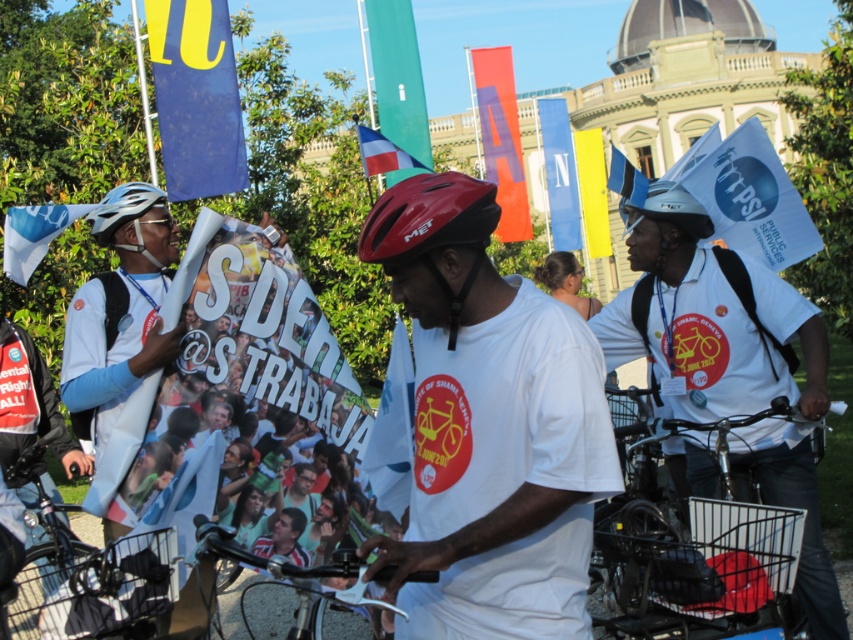
Which of these two, blue fabric flag at left or shiny silver helmet at left, stands taller?

blue fabric flag at left

Looking at this image, is blue fabric flag at left bigger than shiny silver helmet at left?

Indeed, blue fabric flag at left has a larger size compared to shiny silver helmet at left.

Who is more forward, [10,240] or [113,216]?

Point [10,240]

I want to click on blue fabric flag at left, so click(x=33, y=234).

Is white matte t-shirt at center closer to camera compared to blue fabric flag at left?

Yes, it is.

Image resolution: width=853 pixels, height=640 pixels. What are the coordinates of `white matte t-shirt at center` in the screenshot? It's located at (489, 426).

Where is `white matte t-shirt at center`? white matte t-shirt at center is located at coordinates (489, 426).

At what (x,y) coordinates should I click in order to perform the action: click on white paper poster at center. Please return your answer as a coordinate pair (x, y). This screenshot has height=640, width=853. Looking at the image, I should click on (242, 404).

Who is more forward, (169,320) or (505,134)?

Point (169,320) is more forward.

The height and width of the screenshot is (640, 853). In order to click on white paper poster at center in this screenshot , I will do `click(242, 404)`.